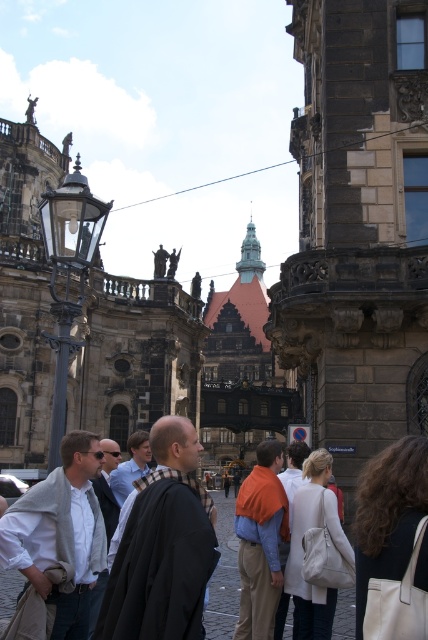
You are a photographer trying to capture both the orange cotton sweater at center and the plaid wool scarf at center in a single shot. Given that your camera has a 50mm lens, which has a field of view that can capture objects up to 30 feet apart in the same frame, will you be able to include both in your photo?

The orange cotton sweater at center and plaid wool scarf at center are 32.85 feet apart, which exceeds the camera lens field of view limit of 30 feet. Therefore, you cannot capture both in a single shot.

You are a tailor observing the clothing items in the square. You notice the orange cotton sweater at center and the plaid wool scarf at center. Which clothing item is thinner?

The orange cotton sweater at center is thinner than the plaid wool scarf at center.